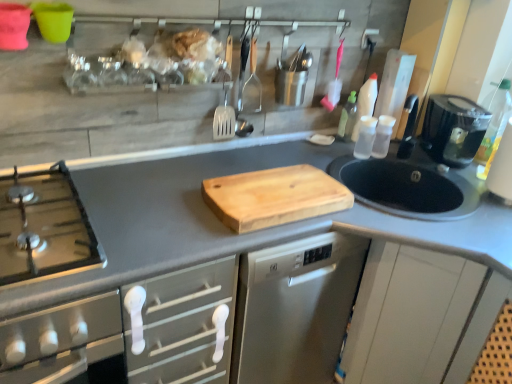
Question: Would you say transparent plastic bottles at right, the 2th bottle viewed from the right, is to the left or to the right of transparent plastic bottle at right, the first bottle positioned from the right, in the picture?

Choices:
 (A) right
 (B) left

Answer: (B)

Question: From the image's perspective, is transparent plastic bottles at right, the 2th bottle viewed from the right, above or below transparent plastic bottle at right, the first bottle positioned from the right?

Choices:
 (A) above
 (B) below

Answer: (B)

Question: Based on their relative distances, which object is farther from the black plastic coffee maker at right?

Choices:
 (A) transparent plastic bottle at upper right, which is the third bottle in right-to-left order
 (B) natural wood cutting board at center
 (C) transparent plastic bottles at right, placed as the second bottle when sorted from left to right
 (D) transparent plastic bottle at right, the first bottle positioned from the right

Answer: (B)

Question: Estimate the real-world distances between objects in this image. Which object is closer to the natural wood cutting board at center?

Choices:
 (A) black plastic coffee maker at right
 (B) transparent plastic bottles at right, placed as the second bottle when sorted from left to right
 (C) transparent plastic bottle at upper right, which is the first bottle in left-to-right order
 (D) transparent plastic bottle at right, the third bottle viewed from the left

Answer: (B)